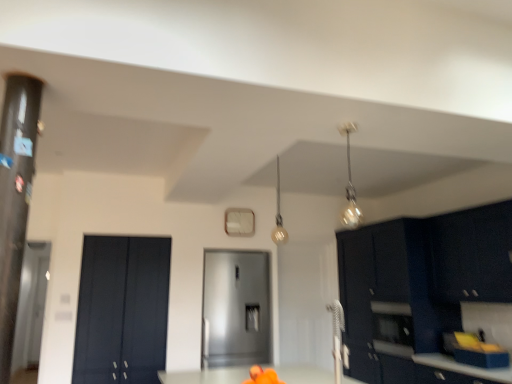
At what (x,y) coordinates should I click in order to perform the action: click on vacant point above matte black cabinet at left, acting as the second door starting from the right (from a real-world perspective). Please return your answer as a coordinate pair (x, y). Looking at the image, I should click on (126, 230).